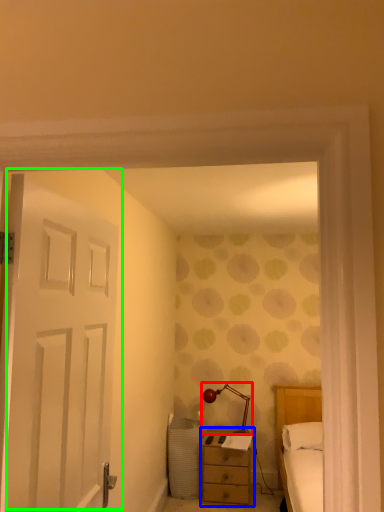
Question: Which is nearer to the table lamp (highlighted by a red box)? nightstand (highlighted by a blue box) or door (highlighted by a green box).

Choices:
 (A) nightstand
 (B) door

Answer: (A)